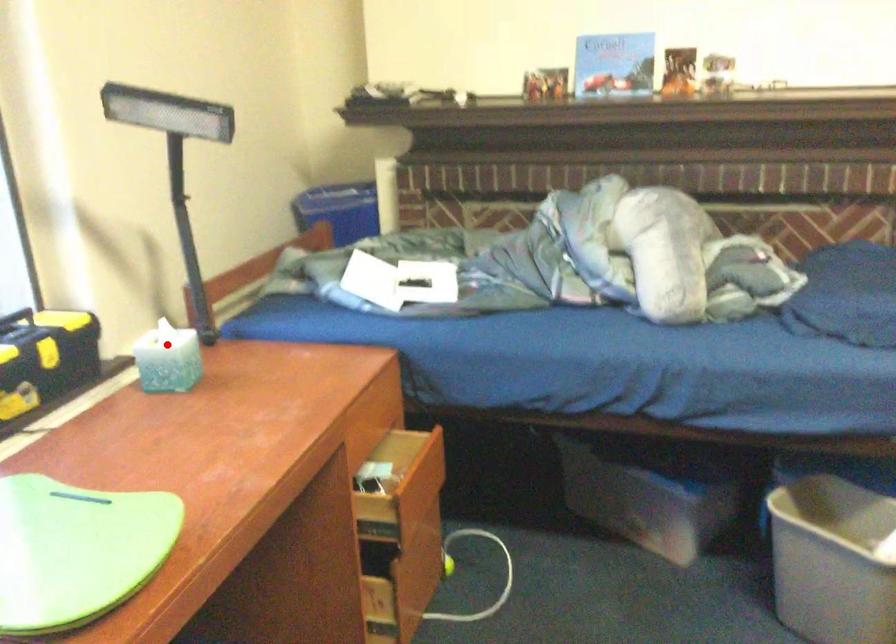
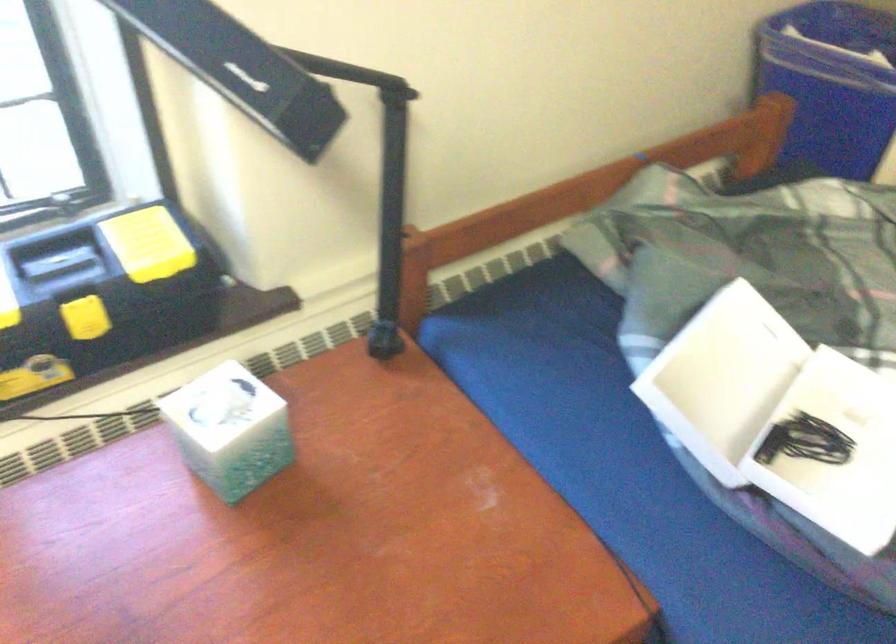
Where in the second image is the point corresponding to the highlighted location from the first image?

(229, 430)